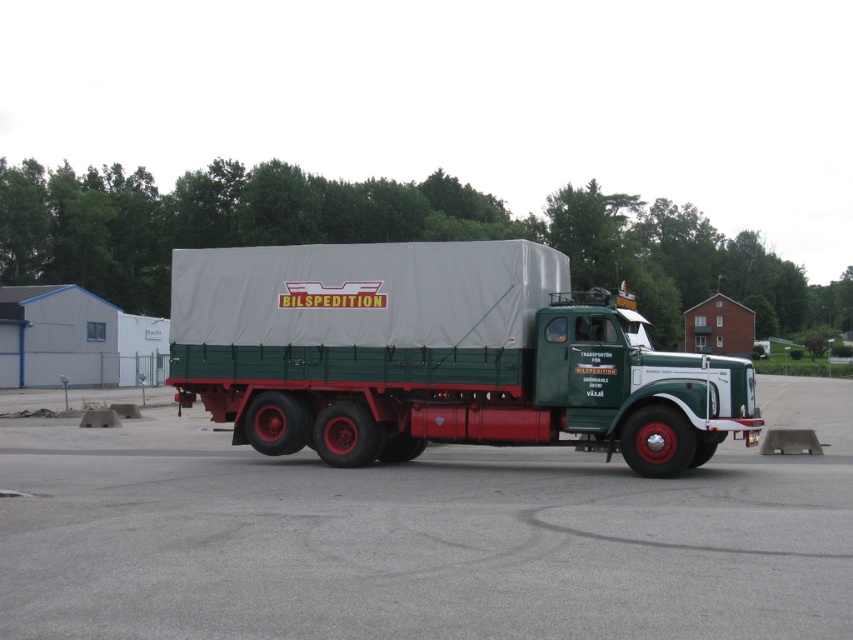
Does point (741, 541) come closer to viewer compared to point (254, 397)?

That is True.

The width and height of the screenshot is (853, 640). Describe the element at coordinates (422, 536) in the screenshot. I see `gray asphalt parking lot at center` at that location.

Does point (96, 632) lie in front of point (204, 362)?

That is True.

Where is `gray asphalt parking lot at center`? This screenshot has width=853, height=640. gray asphalt parking lot at center is located at coordinates (422, 536).